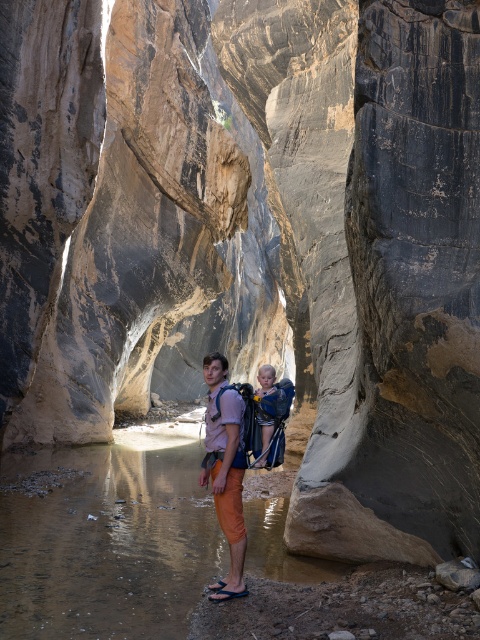
Question: Which object is positioned closest to the orange cotton shorts at center?

Choices:
 (A) blue fabric baby carrier at center
 (B) brown smooth river at center

Answer: (A)

Question: Which point is closer to the camera?

Choices:
 (A) orange cotton shorts at center
 (B) blue fabric baby carrier at center
 (C) brown smooth river at center

Answer: (C)

Question: Which of the following is the closest to the observer?

Choices:
 (A) (269, 394)
 (B) (0, 465)

Answer: (A)

Question: Observing the image, what is the correct spatial positioning of orange cotton shorts at center in reference to blue fabric baby carrier at center?

Choices:
 (A) left
 (B) right

Answer: (A)

Question: In this image, where is orange cotton shorts at center located relative to blue fabric baby carrier at center?

Choices:
 (A) below
 (B) above

Answer: (A)

Question: Can you confirm if orange cotton shorts at center is smaller than blue fabric baby carrier at center?

Choices:
 (A) yes
 (B) no

Answer: (B)